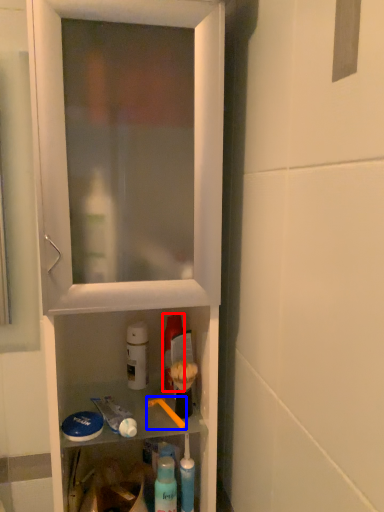
Question: Which object is closer to the camera taking this photo, mouthwash (highlighted by a red box) or brush (highlighted by a blue box)?

Choices:
 (A) mouthwash
 (B) brush

Answer: (B)